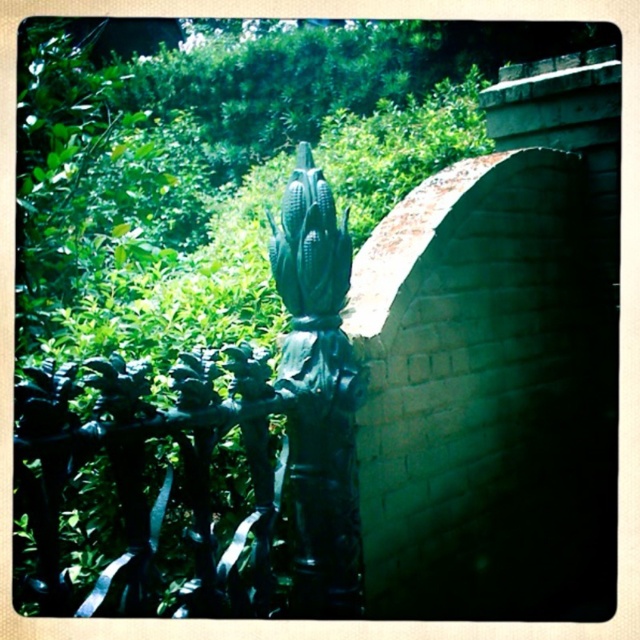
Question: Which of the following is the farthest from the observer?

Choices:
 (A) (20, 429)
 (B) (296, 436)

Answer: (B)

Question: Does dark green wrought iron at left appear on the right side of green matte corn cob at center?

Choices:
 (A) no
 (B) yes

Answer: (A)

Question: Which of the following is the closest to the observer?

Choices:
 (A) green matte corn cob at center
 (B) dark green wrought iron at left

Answer: (B)

Question: In this image, where is dark green wrought iron at left located relative to green matte corn cob at center?

Choices:
 (A) below
 (B) above

Answer: (A)

Question: Observing the image, what is the correct spatial positioning of dark green wrought iron at left in reference to green matte corn cob at center?

Choices:
 (A) left
 (B) right

Answer: (A)

Question: Which point is farther to the camera?

Choices:
 (A) green matte corn cob at center
 (B) dark green wrought iron at left

Answer: (A)